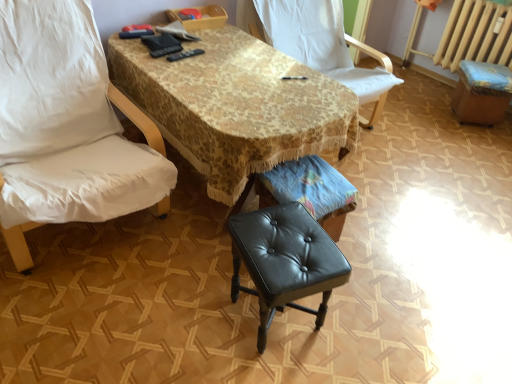
You are a GUI agent. You are given a task and a screenshot of the screen. Output one action in this format:
    pyautogui.click(x=<x>, y=<y>)
    Task: Click on the free space above black leather bar stool at lower right (from a real-world perspective)
    The image size is (512, 384).
    Given the screenshot: What is the action you would take?
    pyautogui.click(x=490, y=68)